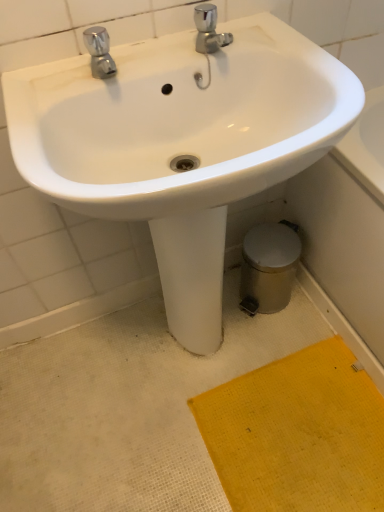
Locate an element on the screen. The height and width of the screenshot is (512, 384). free spot below yellow textured mat at lower right (from a real-world perspective) is located at coordinates (298, 439).